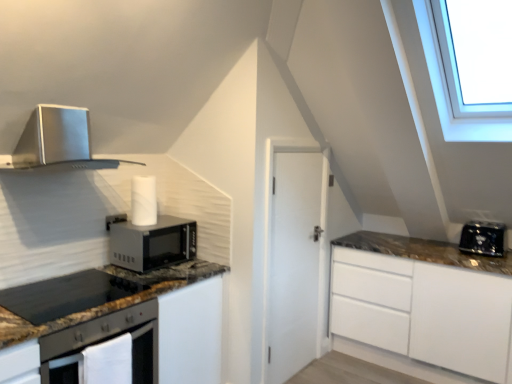
Question: Does point (99, 306) appear closer or farther from the camera than point (473, 221)?

Choices:
 (A) closer
 (B) farther

Answer: (A)

Question: Is black granite countertop at lower left wider or thinner than black plastic toaster at right?

Choices:
 (A) thin
 (B) wide

Answer: (B)

Question: Based on their relative distances, which object is nearer to the metallic matte microwave oven at center-left?

Choices:
 (A) black granite gas stove at lower left
 (B) black granite countertop at lower left
 (C) satin silver range hood at upper left
 (D) black plastic toaster at right

Answer: (A)

Question: Based on their relative distances, which object is nearer to the metallic matte microwave oven at center-left?

Choices:
 (A) black granite gas stove at lower left
 (B) satin silver range hood at upper left
 (C) black plastic toaster at right
 (D) black granite countertop at lower left

Answer: (A)